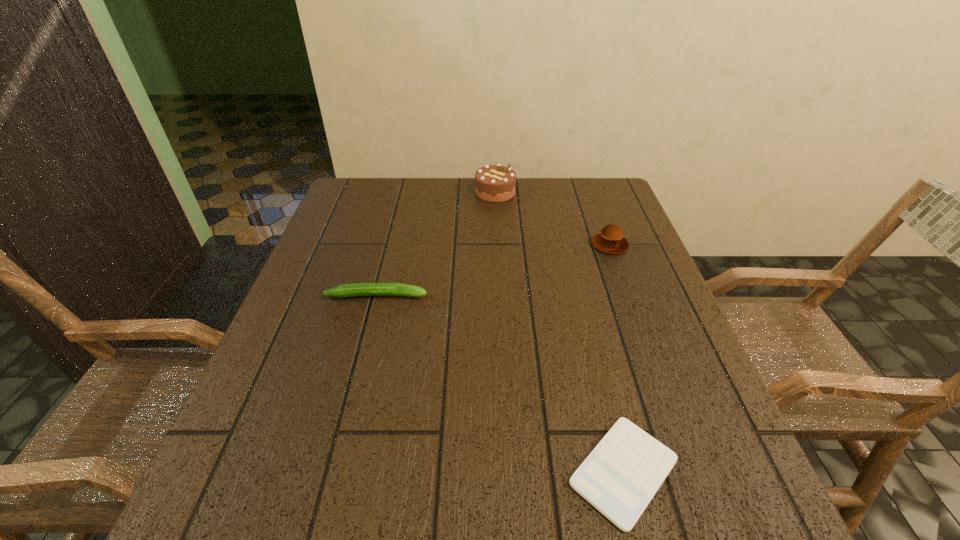
This screenshot has width=960, height=540. In order to click on vacant region located 0.250m on the front-facing side of the zucchini in this screenshot , I will do `click(541, 295)`.

The width and height of the screenshot is (960, 540). In order to click on blank area located 0.150m on the back of the calculator in this screenshot , I will do `click(593, 350)`.

This screenshot has width=960, height=540. I want to click on object at the far edge, so click(493, 183).

Find the location of `object present at the near edge`. object present at the near edge is located at coordinates (621, 475).

The image size is (960, 540). I want to click on object positioned at the left edge, so click(354, 289).

This screenshot has height=540, width=960. In order to click on muffin that is at the right edge in this screenshot , I will do `click(611, 240)`.

I want to click on calculator located at the right edge, so click(x=621, y=475).

The width and height of the screenshot is (960, 540). What are the coordinates of `object that is at the near right corner` in the screenshot? It's located at (621, 475).

In the image, there is a desktop. Identify the location of free space at the far edge. (472, 179).

Locate an element on the screen. The image size is (960, 540). vacant space at the left edge is located at coordinates (383, 240).